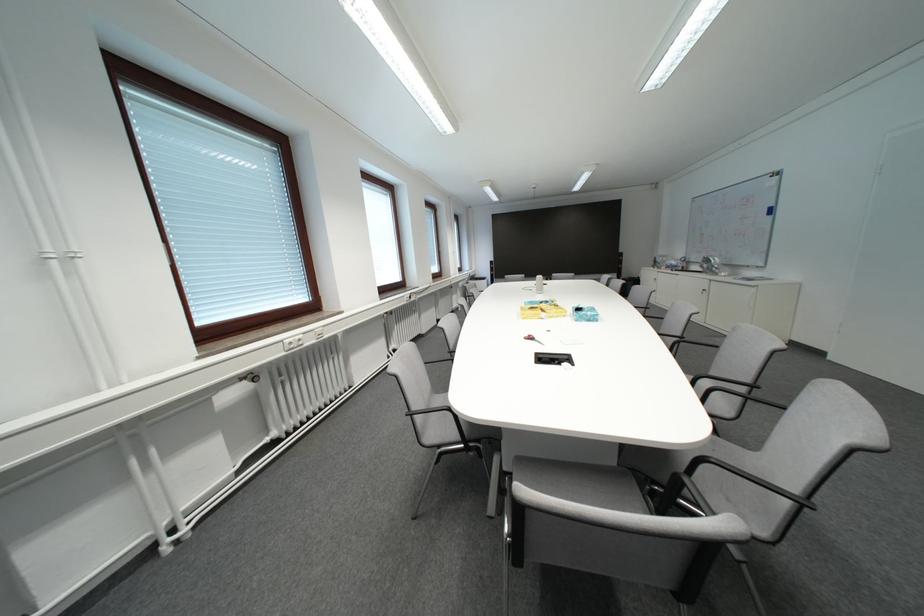
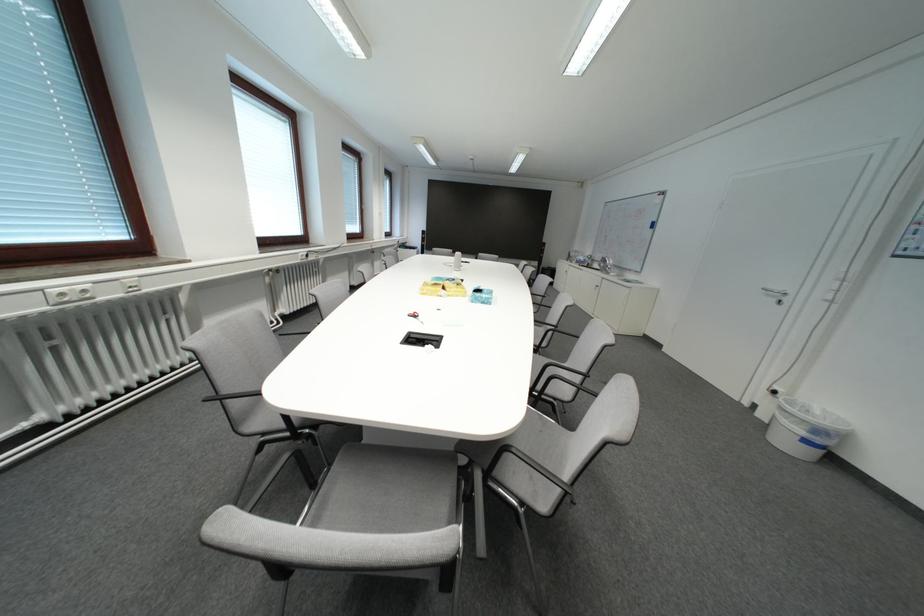
Question: The first image is from the beginning of the video and the second image is from the end. How did the camera likely rotate when shooting the video?

Choices:
 (A) Left
 (B) Right
 (C) Up
 (D) Down

Answer: (B)